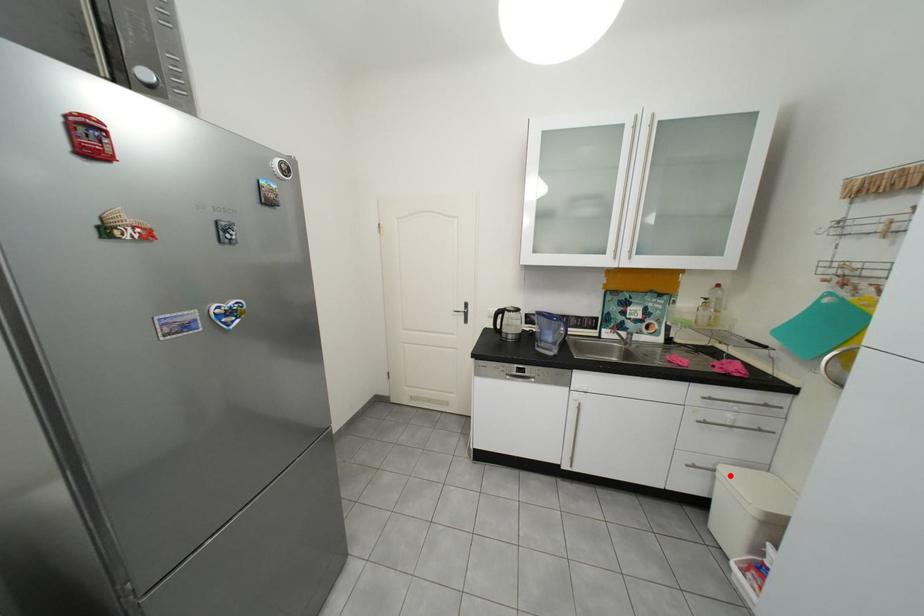
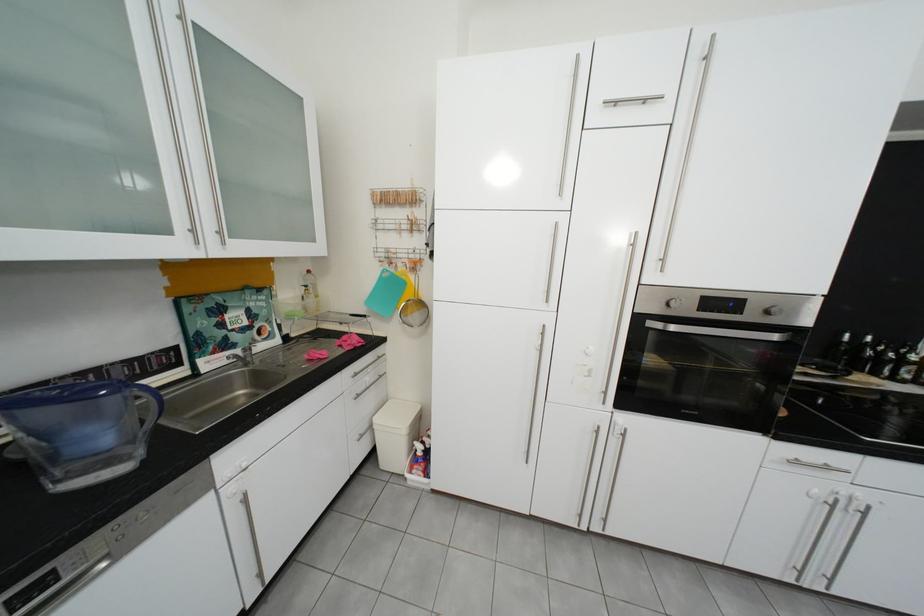
Question: I am providing you with two images of the same scene from different viewpoints. A red point is shown in image1. For the corresponding object point in image2, is it positioned nearer or farther from the camera?

Choices:
 (A) Nearer
 (B) Farther

Answer: (B)